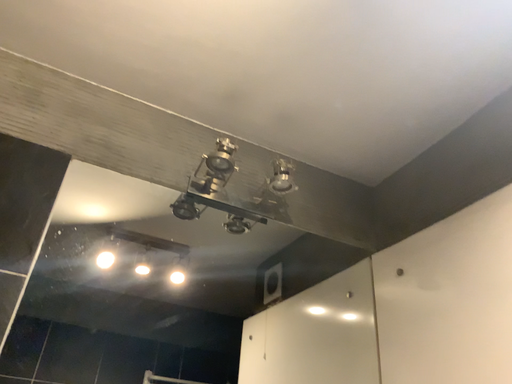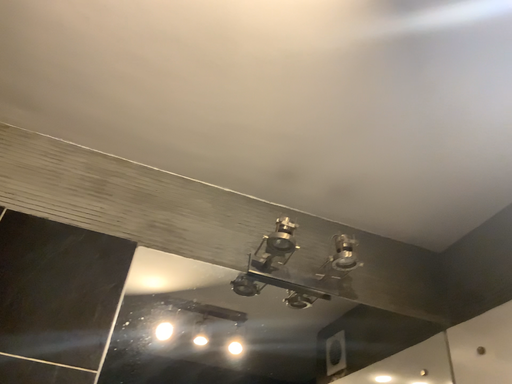
Question: How did the camera likely rotate when shooting the video?

Choices:
 (A) rotated left
 (B) rotated right

Answer: (A)